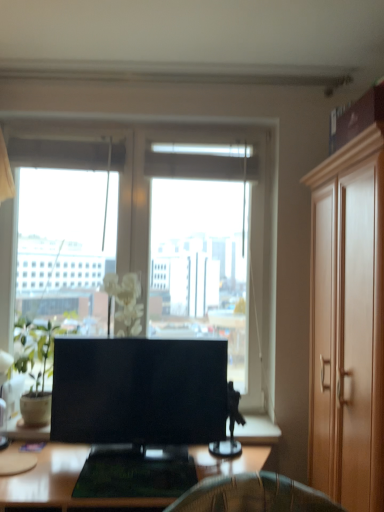
Question: Is matte black tv at center at the right side of light brown wood cabinet at right?

Choices:
 (A) no
 (B) yes

Answer: (A)

Question: Can you confirm if matte black tv at center is taller than light brown wood cabinet at right?

Choices:
 (A) yes
 (B) no

Answer: (B)

Question: From a real-world perspective, does matte black tv at center sit lower than light brown wood cabinet at right?

Choices:
 (A) no
 (B) yes

Answer: (B)

Question: Could you tell me if matte black tv at center is turned towards light brown wood cabinet at right?

Choices:
 (A) no
 (B) yes

Answer: (A)

Question: Can you confirm if matte black tv at center is positioned to the left of light brown wood cabinet at right?

Choices:
 (A) no
 (B) yes

Answer: (B)

Question: Is matte black tv at center shorter than light brown wood cabinet at right?

Choices:
 (A) yes
 (B) no

Answer: (A)

Question: Can you confirm if wooden desk at center is wider than green matte plant at left?

Choices:
 (A) no
 (B) yes

Answer: (B)

Question: From the image's perspective, does wooden desk at center appear higher than green matte plant at left?

Choices:
 (A) yes
 (B) no

Answer: (B)

Question: From a real-world perspective, is wooden desk at center over green matte plant at left?

Choices:
 (A) no
 (B) yes

Answer: (A)

Question: Does wooden desk at center have a greater height compared to green matte plant at left?

Choices:
 (A) yes
 (B) no

Answer: (B)

Question: Is wooden desk at center in front of green matte plant at left?

Choices:
 (A) yes
 (B) no

Answer: (A)

Question: Is the position of wooden desk at center more distant than that of green matte plant at left?

Choices:
 (A) no
 (B) yes

Answer: (A)

Question: Is light brown wood cabinet at right oriented towards wooden desk at center?

Choices:
 (A) yes
 (B) no

Answer: (A)